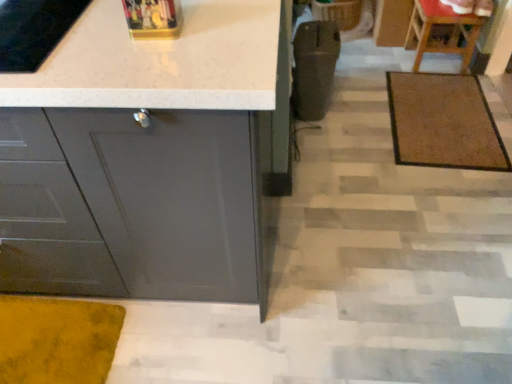
The height and width of the screenshot is (384, 512). Identify the location of free spot below brown textured mat at center right (from a real-world perspective). (445, 120).